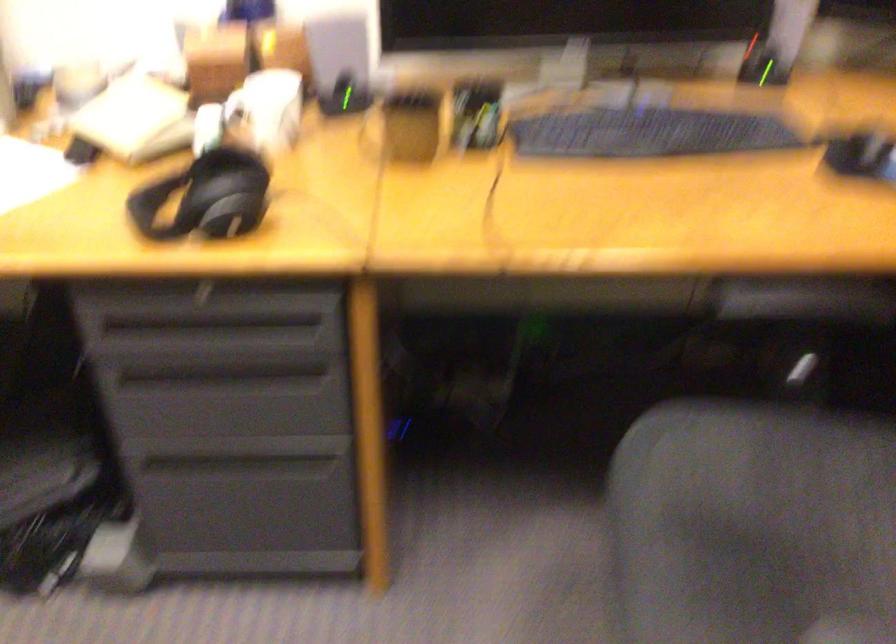
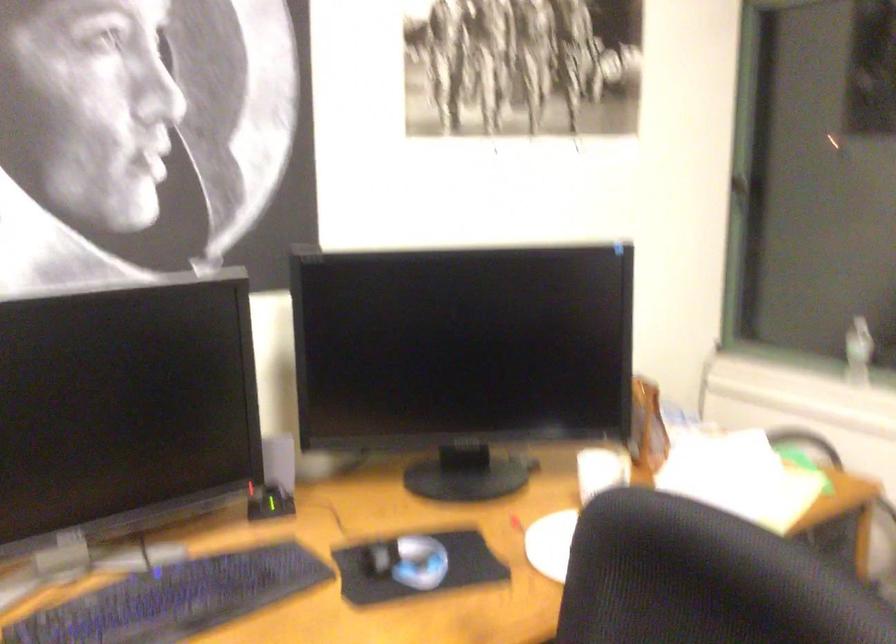
The first image is from the beginning of the video and the second image is from the end. How did the camera likely rotate when shooting the video?

The rotation direction of the camera is right-up.